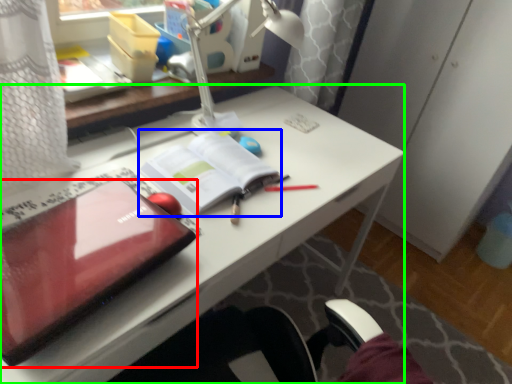
Question: Which is farther away from laptop (highlighted by a red box)? paperback book (highlighted by a blue box) or desk (highlighted by a green box)?

Choices:
 (A) paperback book
 (B) desk

Answer: (A)